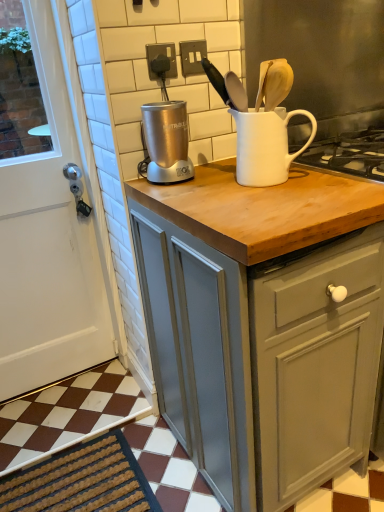
Where is `vacant space that is to the left of white ceramic jug at upper center`? This screenshot has height=512, width=384. vacant space that is to the left of white ceramic jug at upper center is located at coordinates (194, 183).